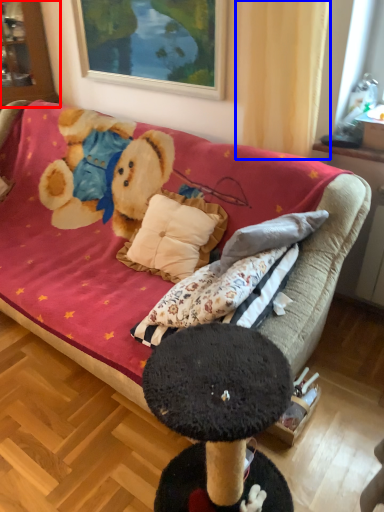
Question: Which point is further to the camera, cabinetry (highlighted by a red box) or curtain (highlighted by a blue box)?

Choices:
 (A) cabinetry
 (B) curtain

Answer: (A)